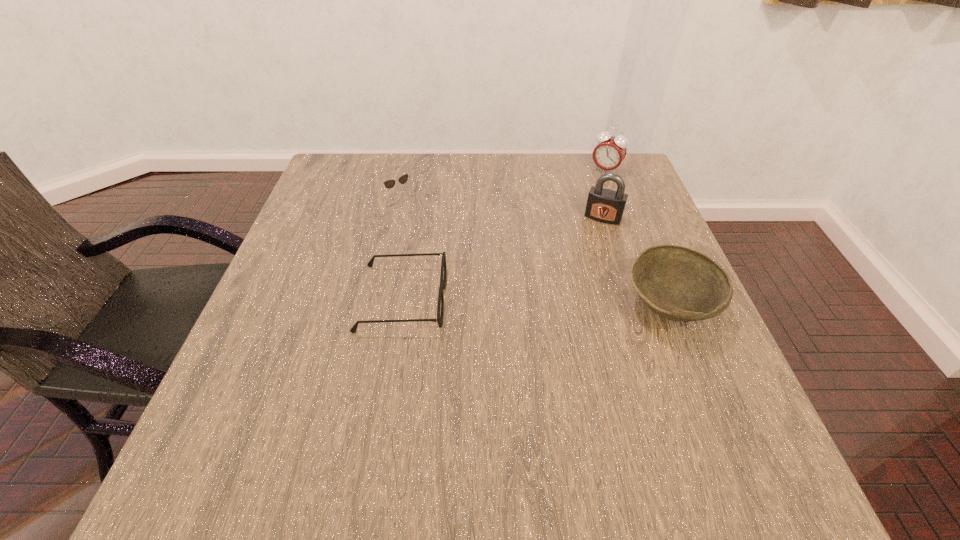
This screenshot has height=540, width=960. Identify the location of vacant space that satisfies the following two spatial constraints: 1. on the front side of the shortest object; 2. on the front-facing side of the sunglasses. [x=379, y=298].

Locate an element on the screen. vacant region that satisfies the following two spatial constraints: 1. on the back side of the alarm clock; 2. on the right side of the sunglasses is located at coordinates (407, 170).

Where is `free space that satisfies the following two spatial constraints: 1. on the front side of the bowl; 2. on the left side of the padlock`? free space that satisfies the following two spatial constraints: 1. on the front side of the bowl; 2. on the left side of the padlock is located at coordinates (632, 307).

Locate an element on the screen. Image resolution: width=960 pixels, height=540 pixels. free space in the image that satisfies the following two spatial constraints: 1. on the front side of the spectacles; 2. on the front-facing side of the sunglasses is located at coordinates (379, 298).

Identify the location of vacant space that satisfies the following two spatial constraints: 1. on the back side of the sunglasses; 2. on the left side of the farthest object. Image resolution: width=960 pixels, height=540 pixels. (407, 170).